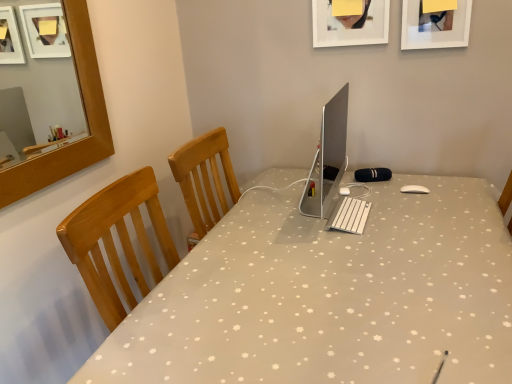
Find the location of a particular element. This screenshot has height=384, width=512. vacant space situated on the left part of silver metallic computer monitor at center is located at coordinates (258, 218).